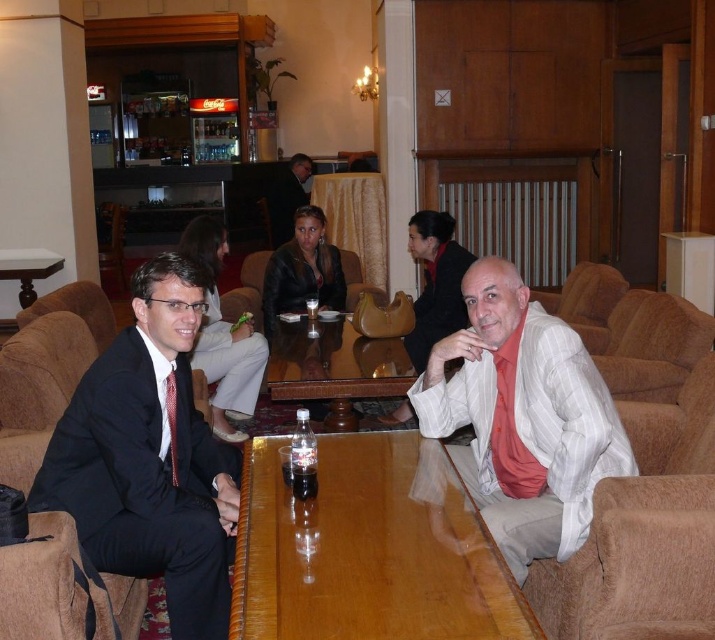
You are a guest at this gathering and want to sit in the brown leather armchair at left. However, there is a leather jacket at center in the way. To reach the chair, do you need to move the jacket to your left or right?

The leather jacket at center is positioned on the right side of brown leather armchair at left. To reach the brown leather armchair at left, you need to move the leather jacket at center to your left.

You are a server carrying a tray of drinks and need to navigate between the wooden polished table at center and the wooden table at center. What is the minimum distance you need to maintain between the tray and both tables to avoid collisions?

The minimum distance you need to maintain between the tray and both tables is 0.585 meters, as the two tables are 1.17 meters apart. This allows for a safe passage while keeping equal distance from both tables.

You are planning to host a guest who prefers seating with more space. Which chair between the beige plush armchair at right and the brown leather armchair at left would you recommend based on their sizes?

The beige plush armchair at right has a larger width than the brown leather armchair at left, so it would provide more seating space for your guest.